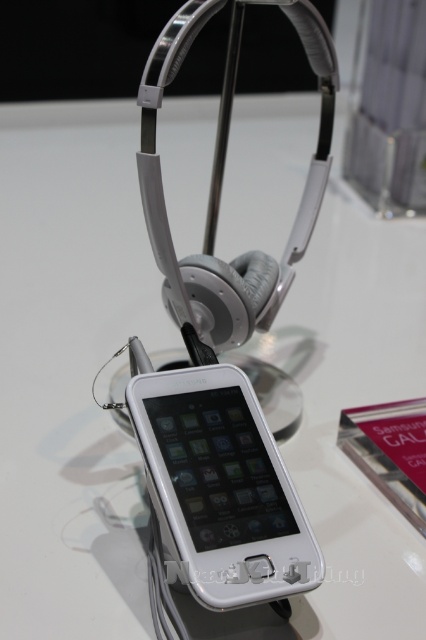
You are looking at the display setup and need to locate two specific points marked in the image. The first point is at coordinate point (x=198, y=436) and the second is at point (x=255, y=301). Which point is closer to you from your viewing position?

Point (x=198, y=436) is in front of point (x=255, y=301), so it is closer to you.

You are setting up a product display and want to ensure that the white glossy ipod at center doesn not block the view of the satin silver headphones at upper center. Based on their sizes, will the ipod be shorter than the headphones?

The white glossy ipod at center is not as tall as satin silver headphones at upper center, meaning the ipod is shorter. Therefore, placing it below the headphones will keep the headphones visible.